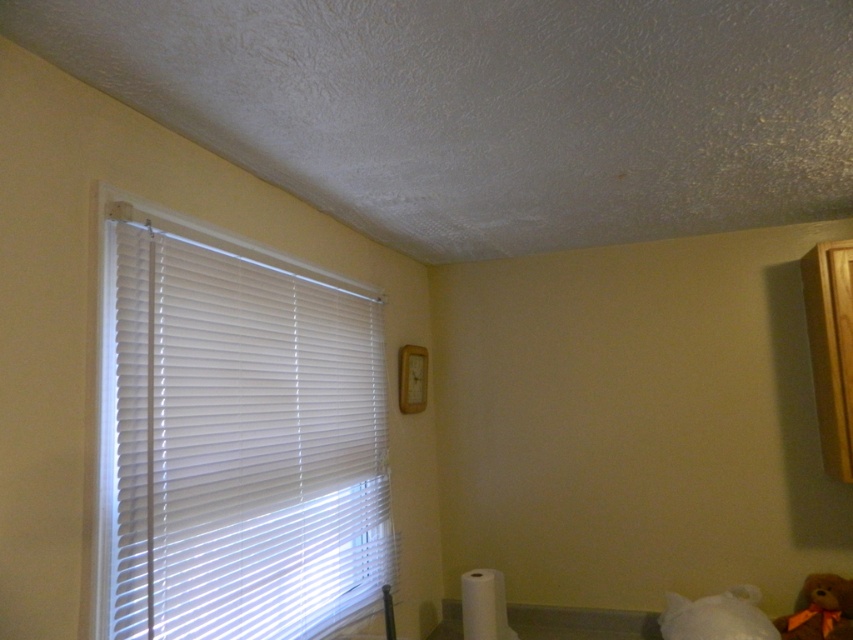
You are standing in the room and want to see the brown plush teddy bear at lower right. Can you see it through the white plastic blinds at left?

The white plastic blinds at left is positioned over brown plush teddy bear at lower right, so the blinds are blocking the view of the teddy bear from that angle.

You are standing in the room and want to adjust the white plastic blinds at left to let in more light. Based on their current position, can you estimate where exactly they are located in the room?

The white plastic blinds at left are located at point 0.684 on the x axis and 0.277 on the y axis.

You are a child who wants to see outside through the white plastic blinds at left. However, there is a brown plush teddy bear at lower right in the way. Can you move the teddy bear to the right to get a better view?

The white plastic blinds at left are to the left of the brown plush teddy bear at lower right. Moving the teddy bear to the right would allow you to see the blinds better.